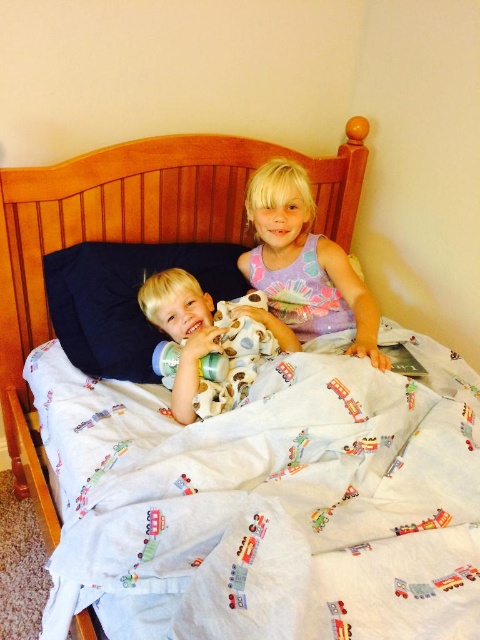
Question: Which object is positioned farthest from the matte white plush toy at center?

Choices:
 (A) pastel tie-dye tank top at upper center
 (B) dark blue fabric pillow at left

Answer: (A)

Question: Can you confirm if dark blue fabric pillow at left is bigger than matte white plush toy at center?

Choices:
 (A) no
 (B) yes

Answer: (B)

Question: Which object is positioned farthest from the dark blue fabric pillow at left?

Choices:
 (A) pastel tie-dye tank top at upper center
 (B) matte white plush toy at center

Answer: (A)

Question: Which point appears closest to the camera in this image?

Choices:
 (A) (157, 324)
 (B) (96, 304)

Answer: (B)

Question: Is pastel tie-dye tank top at upper center behind matte white plush toy at center?

Choices:
 (A) no
 (B) yes

Answer: (B)

Question: Does dark blue fabric pillow at left appear over matte white plush toy at center?

Choices:
 (A) yes
 (B) no

Answer: (A)